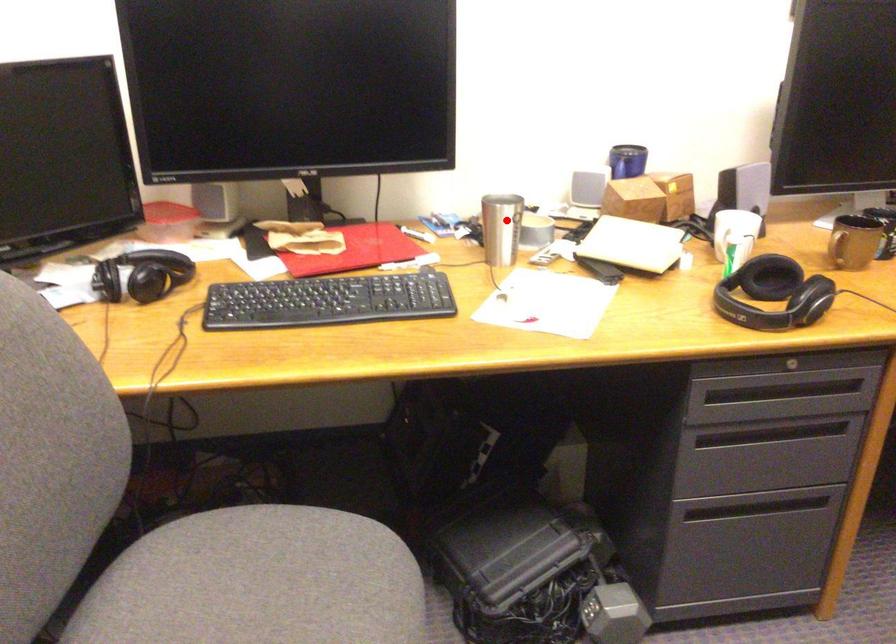
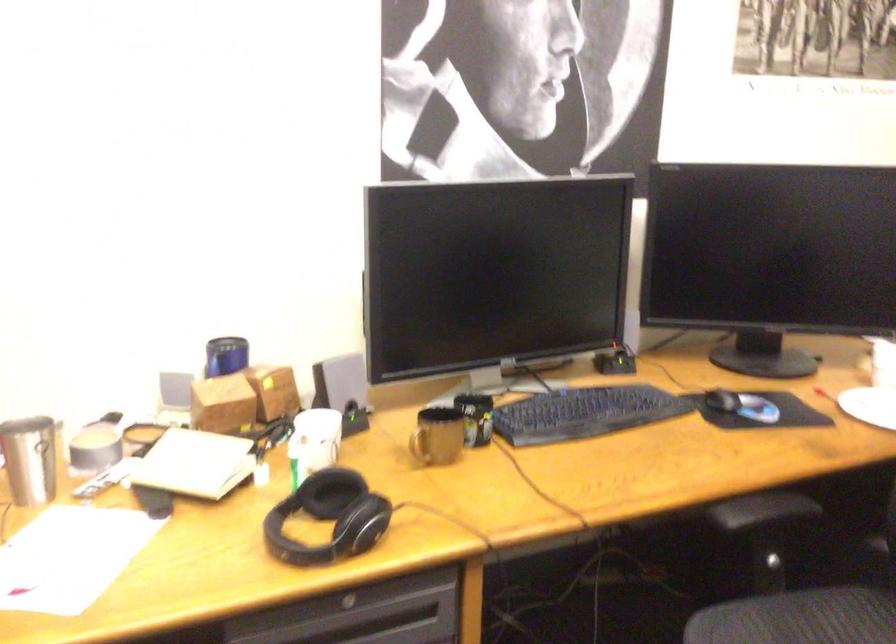
The point at the highlighted location is marked in the first image. Where is the corresponding point in the second image?

(30, 459)